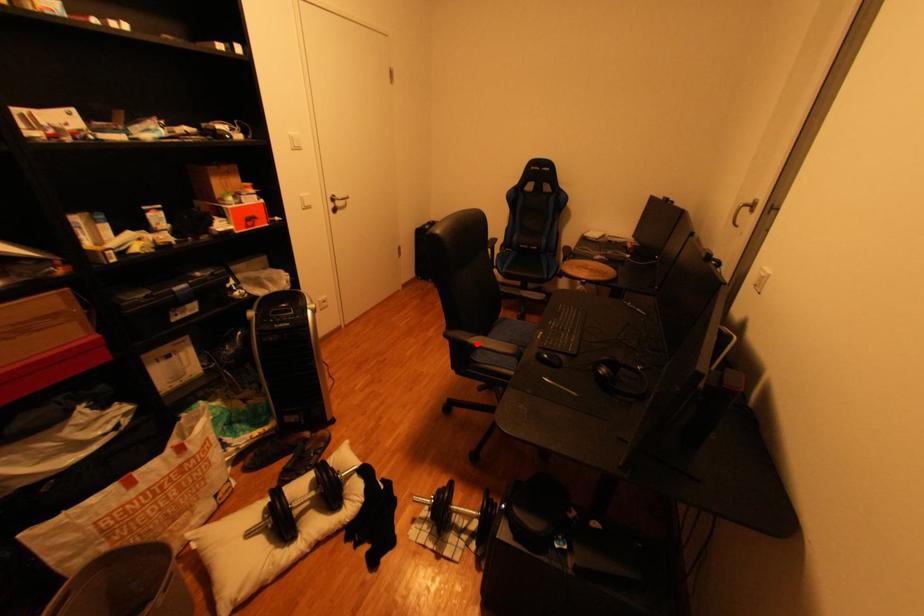
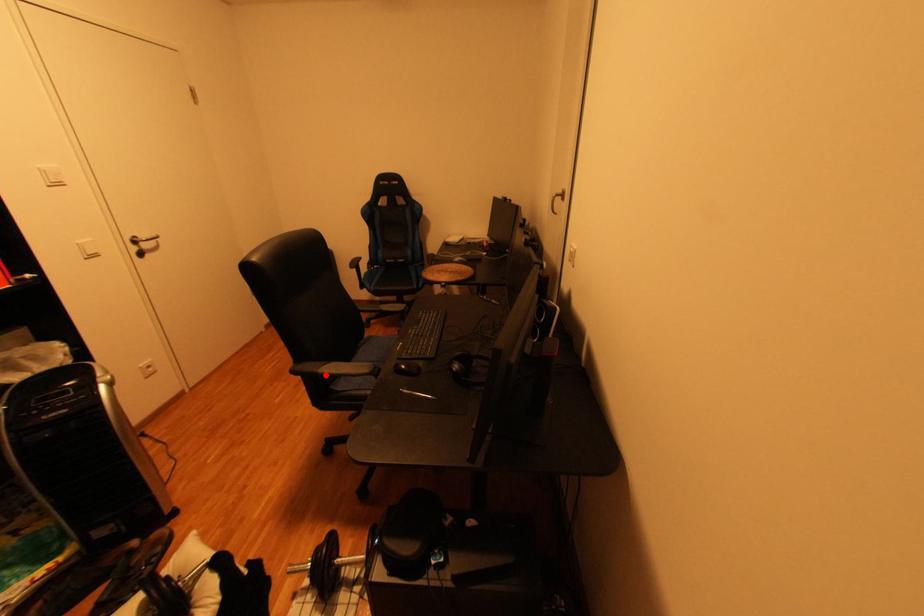
I am providing you with two images of the same scene from different viewpoints. A red point is marked on the first image and another point is marked on the second image. Does the point marked in image1 correspond to the same location as the one in image2?

Yes